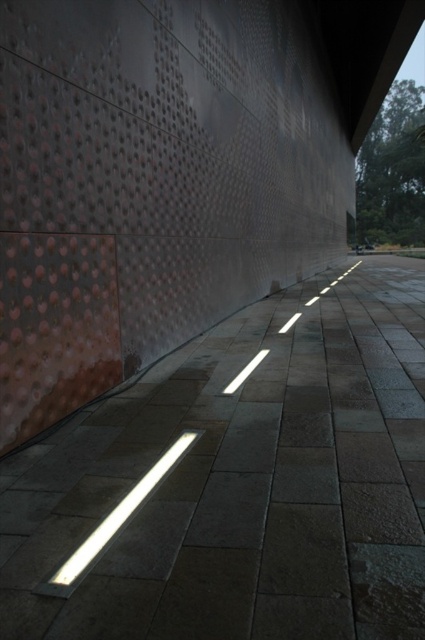
Question: Can you confirm if slate gray paving stone at center is positioned below white glossy rectangular light at center?

Choices:
 (A) no
 (B) yes

Answer: (A)

Question: Can you confirm if slate gray paving stone at center is positioned below white glossy rectangular light at center?

Choices:
 (A) yes
 (B) no

Answer: (B)

Question: Does slate gray paving stone at center have a lesser width compared to white glossy rectangular light at center?

Choices:
 (A) yes
 (B) no

Answer: (B)

Question: Which point is farther to the camera?

Choices:
 (A) (130, 516)
 (B) (353, 451)

Answer: (B)

Question: Which of the following is the farthest from the observer?

Choices:
 (A) white glossy rectangular light at center
 (B) slate gray paving stone at center

Answer: (A)